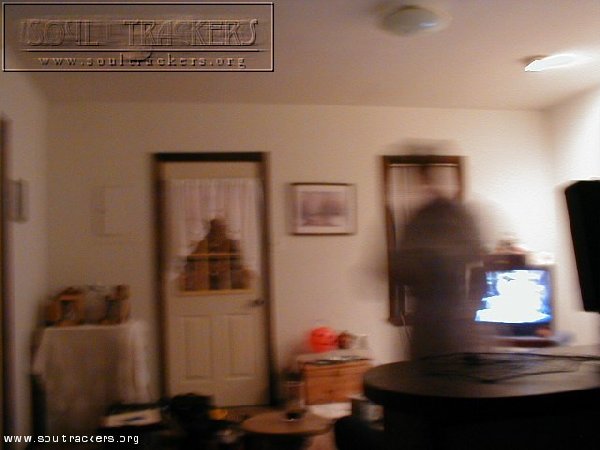
This screenshot has width=600, height=450. I want to click on window, so click(x=202, y=210).